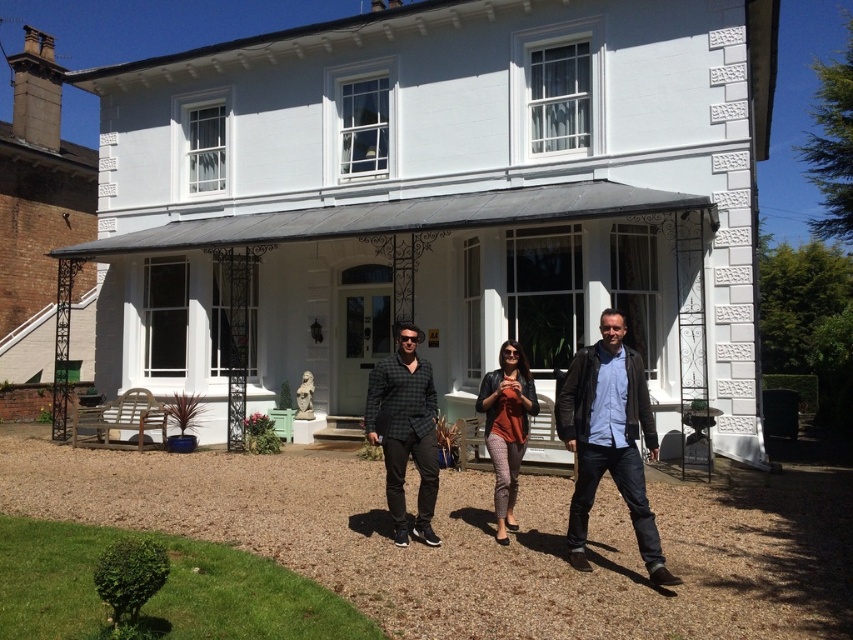
Is leather jacket at center smaller than matte orange top at center?

No.

Between leather jacket at center and matte orange top at center, which one has less height?

Standing shorter between the two is matte orange top at center.

Between point (663, 573) and point (489, 401), which one is positioned behind?

Point (489, 401)

Locate an element on the screen. leather jacket at center is located at coordinates (608, 440).

Can you confirm if matte black jacket at center is thinner than leather jacket at center?

In fact, matte black jacket at center might be wider than leather jacket at center.

Does matte black jacket at center have a greater width compared to leather jacket at center?

Yes, matte black jacket at center is wider than leather jacket at center.

Is point (622, 378) more distant than point (579, 544)?

No, it is in front of (579, 544).

Locate an element on the screen. This screenshot has height=640, width=853. matte black jacket at center is located at coordinates click(608, 440).

Which is in front, point (403, 536) or point (503, 404)?

Point (403, 536) is in front.

Does checkered fabric shirt at center have a larger size compared to matte orange top at center?

Yes, checkered fabric shirt at center is bigger than matte orange top at center.

At what (x,y) coordinates should I click in order to perform the action: click on checkered fabric shirt at center. Please return your answer as a coordinate pair (x, y). Looking at the image, I should click on (405, 429).